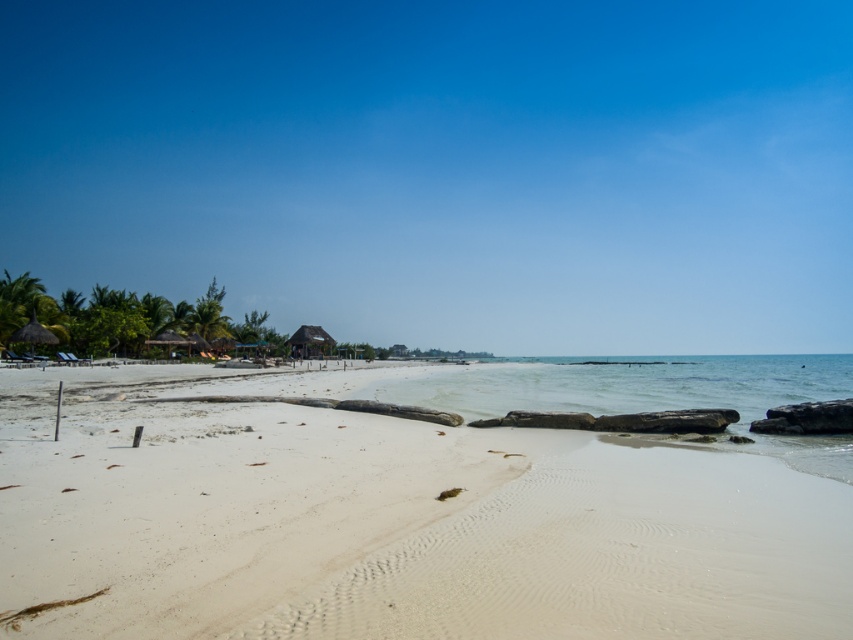
Who is shorter, white sand beach at center or thatched roof hut at center?

Standing shorter between the two is white sand beach at center.

Between point (828, 593) and point (320, 337), which one is positioned in front?

Positioned in front is point (828, 593).

Does point (260, 589) come farther from viewer compared to point (302, 332)?

No, it is not.

You are a GUI agent. You are given a task and a screenshot of the screen. Output one action in this format:
    pyautogui.click(x=<x>, y=<y>)
    Task: Click on the white sand beach at center
    
    Given the screenshot: What is the action you would take?
    pyautogui.click(x=421, y=506)

Which of these two, white sand beach at center or clear water at lower right, stands taller?

With more height is clear water at lower right.

Who is higher up, white sand beach at center or clear water at lower right?

white sand beach at center is higher up.

Identify the location of white sand beach at center. (421, 506).

Is clear water at lower right shorter than thatched roof hut at center?

No, clear water at lower right is not shorter than thatched roof hut at center.

Between clear water at lower right and thatched roof hut at center, which one appears on the left side from the viewer's perspective?

thatched roof hut at center

What do you see at coordinates (648, 394) in the screenshot?
I see `clear water at lower right` at bounding box center [648, 394].

What are the coordinates of `clear water at lower right` in the screenshot? It's located at pyautogui.click(x=648, y=394).